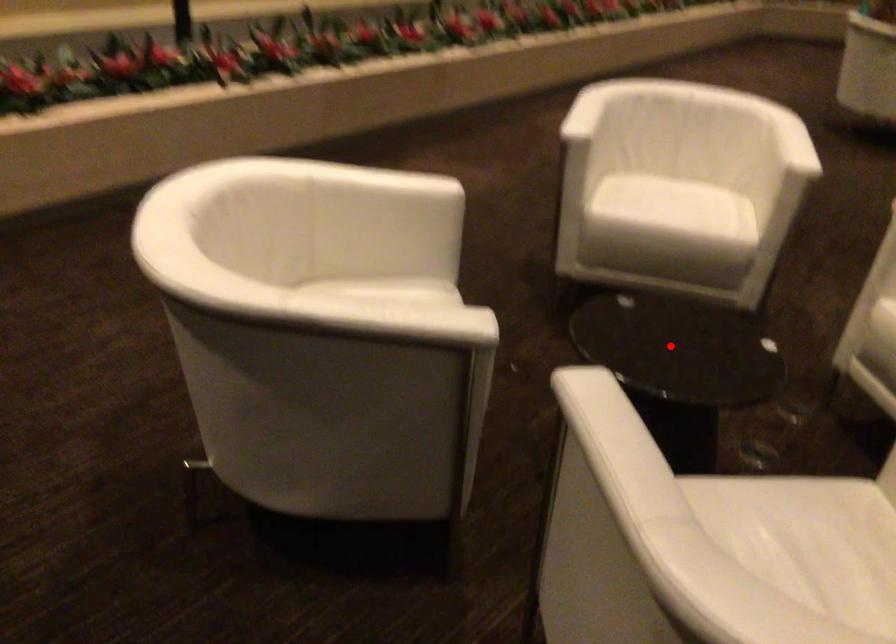
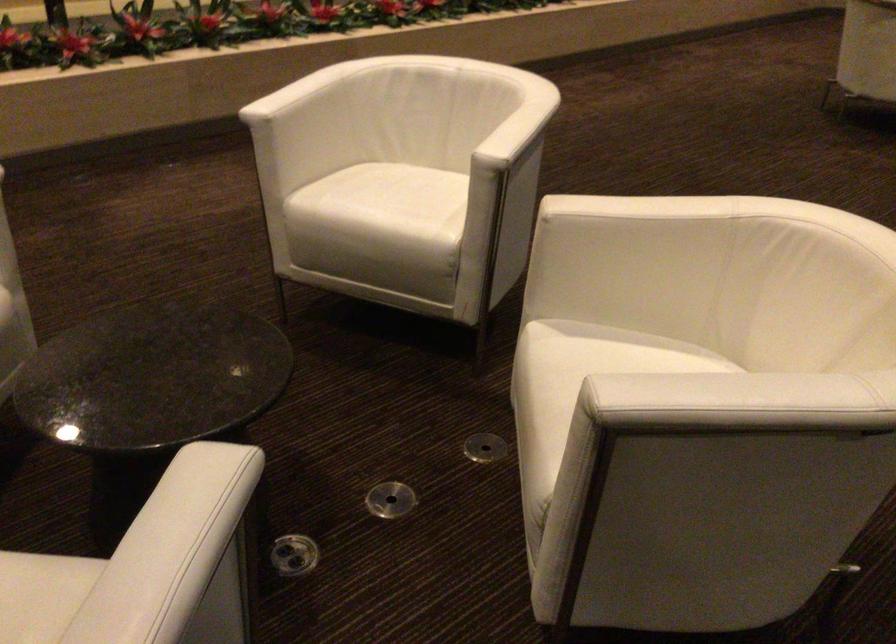
The point at the highlighted location is marked in the first image. Where is the corresponding point in the second image?

(152, 377)